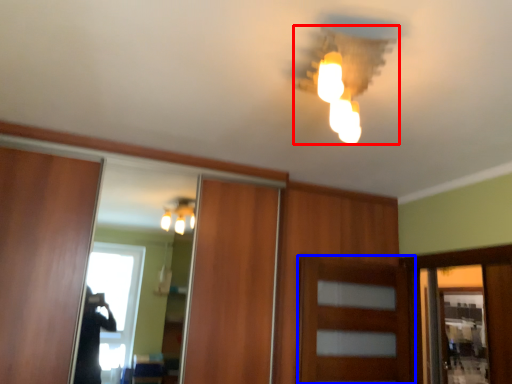
Question: Which object is closer to the camera taking this photo, lamp (highlighted by a red box) or door (highlighted by a blue box)?

Choices:
 (A) lamp
 (B) door

Answer: (A)